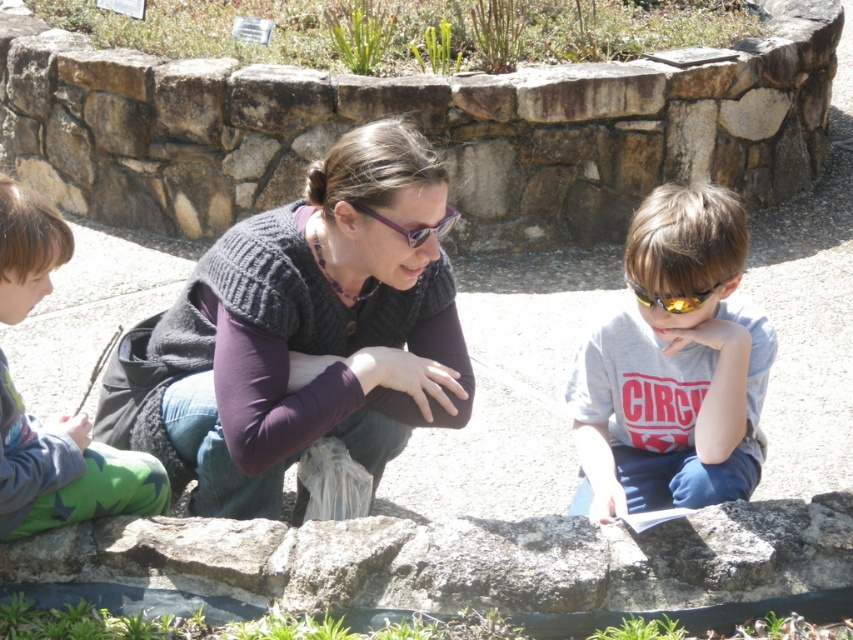
Can you confirm if brown stone wall at center is taller than gray rough stone at center?

Correct, brown stone wall at center is much taller as gray rough stone at center.

Does point (4, 97) lie behind point (780, 589)?

Yes.

Find the location of a particular element. The height and width of the screenshot is (640, 853). brown stone wall at center is located at coordinates (419, 125).

You are a GUI agent. You are given a task and a screenshot of the screen. Output one action in this format:
    pyautogui.click(x=<x>, y=<y>)
    Task: Click on the brown stone wall at center
    This screenshot has width=853, height=640.
    Given the screenshot: What is the action you would take?
    pyautogui.click(x=419, y=125)

Does knitted gray sweater at center come in front of yellow reflective lens sunglasses at center?

No, knitted gray sweater at center is further to the viewer.

Does knitted gray sweater at center appear under yellow reflective lens sunglasses at center?

Yes.

The height and width of the screenshot is (640, 853). What do you see at coordinates (311, 332) in the screenshot?
I see `knitted gray sweater at center` at bounding box center [311, 332].

You are a GUI agent. You are given a task and a screenshot of the screen. Output one action in this format:
    pyautogui.click(x=<x>, y=<y>)
    Task: Click on the knitted gray sweater at center
    
    Given the screenshot: What is the action you would take?
    pyautogui.click(x=311, y=332)

Does knitted gray sweater at center appear under green fleece pants at left?

No.

Is knitted gray sweater at center taller than green fleece pants at left?

Indeed, knitted gray sweater at center has a greater height compared to green fleece pants at left.

You are a GUI agent. You are given a task and a screenshot of the screen. Output one action in this format:
    pyautogui.click(x=<x>, y=<y>)
    Task: Click on the knitted gray sweater at center
    The height and width of the screenshot is (640, 853).
    Given the screenshot: What is the action you would take?
    pyautogui.click(x=311, y=332)